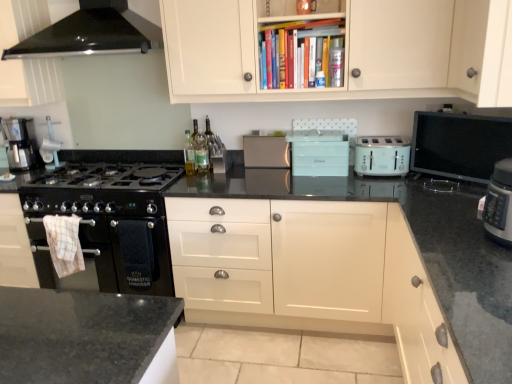
Question: Is metallic silver coffee machine at left oriented towards green glass bottle at center?

Choices:
 (A) yes
 (B) no

Answer: (B)

Question: Can you confirm if metallic silver coffee machine at left is bigger than green glass bottle at center?

Choices:
 (A) no
 (B) yes

Answer: (B)

Question: Is metallic silver coffee machine at left at the left side of green glass bottle at center?

Choices:
 (A) no
 (B) yes

Answer: (B)

Question: Would you say green glass bottle at center is part of metallic silver coffee machine at left's contents?

Choices:
 (A) yes
 (B) no

Answer: (B)

Question: Is the position of metallic silver coffee machine at left more distant than that of green glass bottle at center?

Choices:
 (A) yes
 (B) no

Answer: (A)

Question: Considering their positions, is translucent glass bottle at center, which appears as the 2th bottle when ordered from the bottom, located in front of or behind white matte cabinet at lower right, which ranks as the fourth cabinetry in top-to-bottom order?

Choices:
 (A) behind
 (B) front

Answer: (A)

Question: From a real-world perspective, is translucent glass bottle at center, the 1th bottle in the back-to-front sequence, physically located above or below white matte cabinet at lower right, which ranks as the fourth cabinetry in top-to-bottom order?

Choices:
 (A) below
 (B) above

Answer: (B)

Question: From their relative heights in the image, would you say translucent glass bottle at center, the 1th bottle in the back-to-front sequence, is taller or shorter than white matte cabinet at lower right, which ranks as the fourth cabinetry in top-to-bottom order?

Choices:
 (A) tall
 (B) short

Answer: (B)

Question: Considering the positions of translucent glass bottle at center, which appears as the 2th bottle when ordered from the bottom, and white matte cabinet at lower right, arranged as the 1th cabinetry when ordered from the bottom, in the image, is translucent glass bottle at center, which appears as the 2th bottle when ordered from the bottom, wider or thinner than white matte cabinet at lower right, arranged as the 1th cabinetry when ordered from the bottom,?

Choices:
 (A) wide
 (B) thin

Answer: (B)

Question: Is black glass range hood at upper left in front of or behind green glass bottle at center in the image?

Choices:
 (A) front
 (B) behind

Answer: (A)

Question: From a real-world perspective, is black glass range hood at upper left physically located above or below green glass bottle at center?

Choices:
 (A) above
 (B) below

Answer: (A)

Question: From their relative heights in the image, would you say black glass range hood at upper left is taller or shorter than green glass bottle at center?

Choices:
 (A) tall
 (B) short

Answer: (A)

Question: Based on their positions, is black glass range hood at upper left located to the left or right of green glass bottle at center?

Choices:
 (A) left
 (B) right

Answer: (A)

Question: From a real-world perspective, is satin silver toaster at center, placed as the first appliance when sorted from left to right, physically located above or below mint green plastic toaster at center, which is the second appliance in right-to-left order?

Choices:
 (A) below
 (B) above

Answer: (B)

Question: In terms of height, does satin silver toaster at center, placed as the first appliance when sorted from left to right, look taller or shorter compared to mint green plastic toaster at center, which is the second appliance in right-to-left order?

Choices:
 (A) tall
 (B) short

Answer: (B)